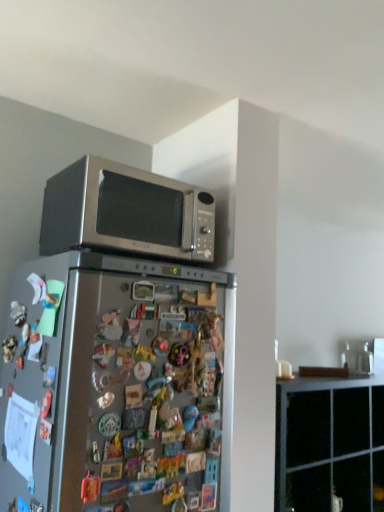
What is the approximate width of black matte cabinet at upper right?

15.18 inches.

Locate an element on the screen. This screenshot has width=384, height=512. black matte cabinet at upper right is located at coordinates pyautogui.click(x=330, y=444).

Is satin silver refrigerator at center positioned with its back to satin silver microwave at upper center?

satin silver refrigerator at center is not turned away from satin silver microwave at upper center.

Can you see satin silver refrigerator at center touching satin silver microwave at upper center?

No.

Based on the photo, is satin silver microwave at upper center inside satin silver refrigerator at center?

No, satin silver microwave at upper center is not a part of satin silver refrigerator at center.

Which of these two, satin silver microwave at upper center or satin silver refrigerator at center, is wider?

Wider between the two is satin silver refrigerator at center.

Is point (199, 210) more distant than point (182, 372)?

Yes.

Looking at this image, considering the sizes of satin silver microwave at upper center and satin silver refrigerator at center in the image, is satin silver microwave at upper center taller or shorter than satin silver refrigerator at center?

satin silver microwave at upper center is shorter than satin silver refrigerator at center.

Considering the positions of objects satin silver microwave at upper center and satin silver refrigerator at center in the image provided, who is more to the left, satin silver microwave at upper center or satin silver refrigerator at center?

From the viewer's perspective, satin silver refrigerator at center appears more on the left side.

The image size is (384, 512). Identify the location of cabinetry below the satin silver microwave at upper center (from the image's perspective). click(x=330, y=444).

From the image's perspective, between satin silver microwave at upper center and black matte cabinet at upper right, who is located below?

black matte cabinet at upper right appears lower in the image.

Is satin silver microwave at upper center oriented towards black matte cabinet at upper right?

No, satin silver microwave at upper center is not oriented towards black matte cabinet at upper right.

Is satin silver microwave at upper center in front of or behind black matte cabinet at upper right in the image?

Visually, satin silver microwave at upper center is located in front of black matte cabinet at upper right.

The height and width of the screenshot is (512, 384). Find the location of `microwave oven above the black matte cabinet at upper right (from the image's perspective)`. microwave oven above the black matte cabinet at upper right (from the image's perspective) is located at coordinates (126, 212).

Is black matte cabinet at upper right looking in the opposite direction of satin silver microwave at upper center?

That's not correct — black matte cabinet at upper right is not looking away from satin silver microwave at upper center.

Can you confirm if black matte cabinet at upper right is taller than satin silver microwave at upper center?

Correct, black matte cabinet at upper right is much taller as satin silver microwave at upper center.

Is point (314, 402) positioned before point (128, 207)?

No.

Is black matte cabinet at upper right a part of satin silver refrigerator at center?

Actually, black matte cabinet at upper right is outside satin silver refrigerator at center.

Which is more to the left, satin silver refrigerator at center or black matte cabinet at upper right?

satin silver refrigerator at center.

Is black matte cabinet at upper right outside of satin silver refrigerator at center?

black matte cabinet at upper right is positioned outside satin silver refrigerator at center.

Which object is positioned more to the right, black matte cabinet at upper right or satin silver refrigerator at center?

black matte cabinet at upper right.

Considering the sizes of objects black matte cabinet at upper right and satin silver refrigerator at center in the image provided, who is thinner, black matte cabinet at upper right or satin silver refrigerator at center?

With smaller width is black matte cabinet at upper right.

From a real-world perspective, who is located higher, black matte cabinet at upper right or satin silver refrigerator at center?

satin silver refrigerator at center.

The width and height of the screenshot is (384, 512). There is a satin silver refrigerator at center. Find the location of `microwave oven above it (from a real-world perspective)`. microwave oven above it (from a real-world perspective) is located at coordinates (126, 212).

Where is `microwave oven above the satin silver refrigerator at center (from the image's perspective)`? microwave oven above the satin silver refrigerator at center (from the image's perspective) is located at coordinates pos(126,212).

Based on their spatial positions, is black matte cabinet at upper right or satin silver refrigerator at center further from satin silver microwave at upper center?

black matte cabinet at upper right lies further to satin silver microwave at upper center than the other object.

From the image, which object appears to be farther from satin silver refrigerator at center, satin silver microwave at upper center or black matte cabinet at upper right?

Among the two, black matte cabinet at upper right is located further to satin silver refrigerator at center.

Based on their spatial positions, is black matte cabinet at upper right or satin silver microwave at upper center closer to satin silver refrigerator at center?

satin silver microwave at upper center.

Looking at this image, based on their spatial positions, is satin silver refrigerator at center or black matte cabinet at upper right further from satin silver microwave at upper center?

black matte cabinet at upper right is positioned further to the anchor satin silver microwave at upper center.

Considering their positions, is satin silver microwave at upper center positioned further to black matte cabinet at upper right than satin silver refrigerator at center?

satin silver microwave at upper center.

Considering their positions, is satin silver refrigerator at center positioned further to black matte cabinet at upper right than satin silver microwave at upper center?

satin silver microwave at upper center.

What are the coordinates of `refrigerator between satin silver microwave at upper center and black matte cabinet at upper right in the vertical direction` in the screenshot? It's located at (113, 386).